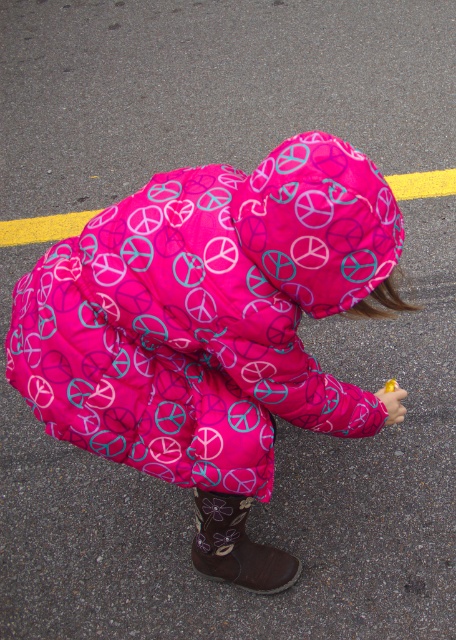
You are a photographer trying to capture the child in the pink puffer jacket walking on the paved surface. The yellow plastic toy at lower right is in your viewfinder. To ensure the toy is centered in the photo, where should you adjust your camera? Use the given coordinates to determine the direction.

The yellow plastic toy at lower right is located at coordinates 0.631 on the x axis and 0.862 on the y axis. To center it, move the camera left and down since the toy is to the right and upper part of the frame.

You are a fashion designer observing the child in the image. You need to determine if the pink quilted coat at center can be paired with the yellow matte food at lower right in a photoshoot. Based on their sizes, will the coat overshadow the food in the composition?

The pink quilted coat at center is wider than the yellow matte food at lower right, so the coat would overshadow the food in the composition.

You are a photographer trying to capture the child in the pink quilted coat at center without including the yellow matte food at lower right in the frame. Based on their positions, is this possible?

The pink quilted coat at center is in front of the yellow matte food at lower right, so it is possible to capture the child in the pink quilted coat at center without including the yellow matte food at lower right by focusing on the foreground.